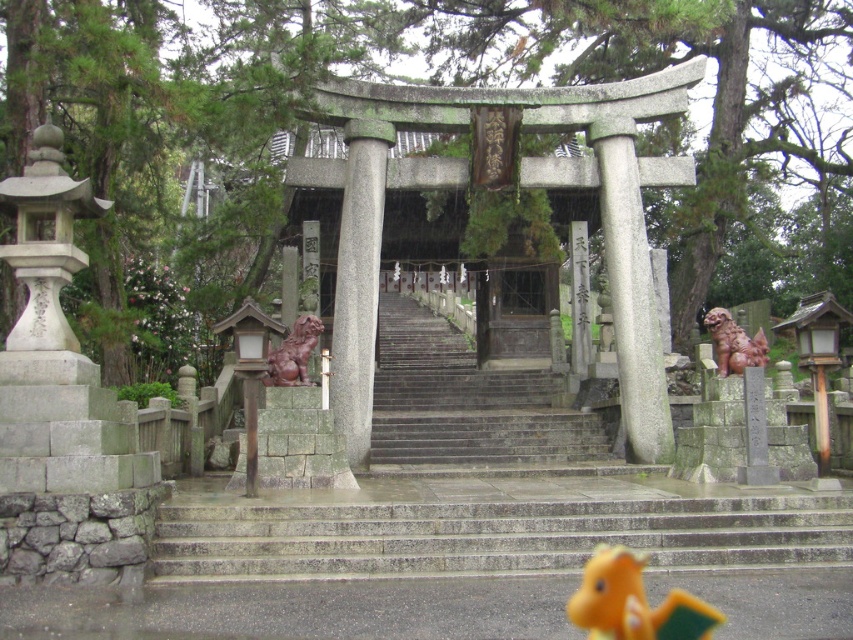
Does gray polished stone column at center appear over orange plush toy at lower center?

Indeed, gray polished stone column at center is positioned over orange plush toy at lower center.

Is point (352, 120) behind point (630, 566)?

That is True.

Locate an element on the screen. This screenshot has height=640, width=853. gray polished stone column at center is located at coordinates (358, 284).

Is gray concrete stairs at center taller than gray polished stone column at center?

Yes, gray concrete stairs at center is taller than gray polished stone column at center.

Can you confirm if gray concrete stairs at center is thinner than gray polished stone column at center?

In fact, gray concrete stairs at center might be wider than gray polished stone column at center.

Is point (811, 541) behind point (349, 221)?

No, (811, 541) is in front of (349, 221).

Where is `gray concrete stairs at center`? The width and height of the screenshot is (853, 640). gray concrete stairs at center is located at coordinates (490, 536).

Who is more forward, (206, 532) or (654, 628)?

Point (654, 628) is in front.

Does gray concrete stairs at center have a lesser width compared to orange plush toy at lower center?

No, gray concrete stairs at center is not thinner than orange plush toy at lower center.

Is point (254, 506) positioned in front of point (590, 616)?

No.

Locate an element on the screen. This screenshot has height=640, width=853. gray concrete stairs at center is located at coordinates (490, 536).